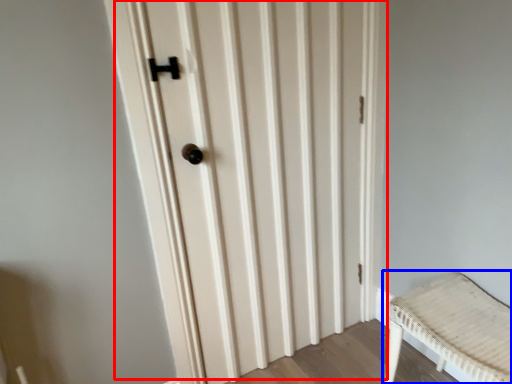
Question: Which object appears farthest to the camera in this image, door (highlighted by a red box) or furniture (highlighted by a blue box)?

Choices:
 (A) door
 (B) furniture

Answer: (A)